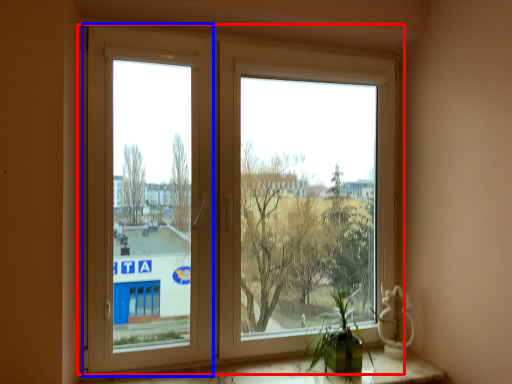
Question: Which of the following is the closest to the observer, window (highlighted by a red box) or window frame (highlighted by a blue box)?

Choices:
 (A) window
 (B) window frame

Answer: (B)